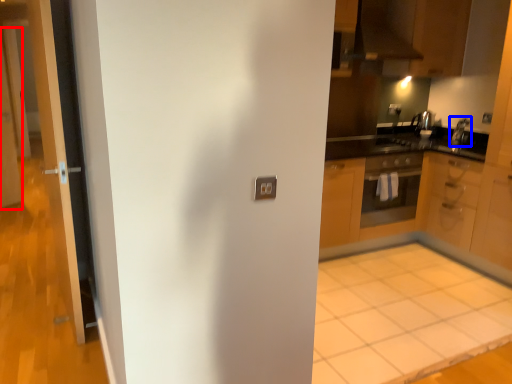
Question: Which point is further to the camera, screen door (highlighted by a red box) or appliance (highlighted by a blue box)?

Choices:
 (A) screen door
 (B) appliance

Answer: (A)